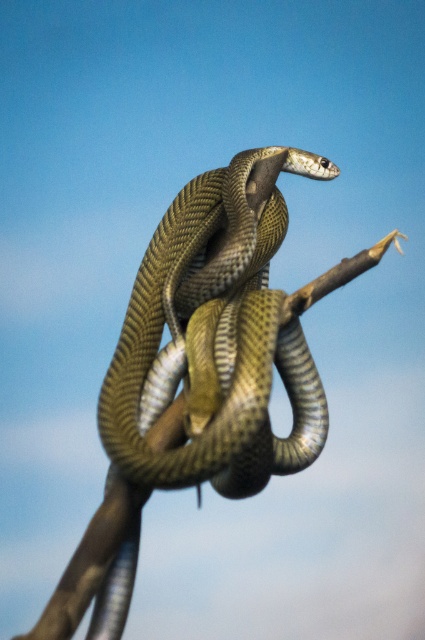
Question: Among these points, which one is nearest to the camera?

Choices:
 (A) (62, 589)
 (B) (241, 221)

Answer: (A)

Question: Is shiny green snake at center thinner than brown wood at center?

Choices:
 (A) no
 (B) yes

Answer: (B)

Question: Which object is closer to the camera taking this photo?

Choices:
 (A) brown wood at center
 (B) shiny green snake at center

Answer: (A)

Question: Is shiny green snake at center closer to camera compared to brown wood at center?

Choices:
 (A) yes
 (B) no

Answer: (B)

Question: Can you confirm if shiny green snake at center is positioned to the right of brown wood at center?

Choices:
 (A) yes
 (B) no

Answer: (A)